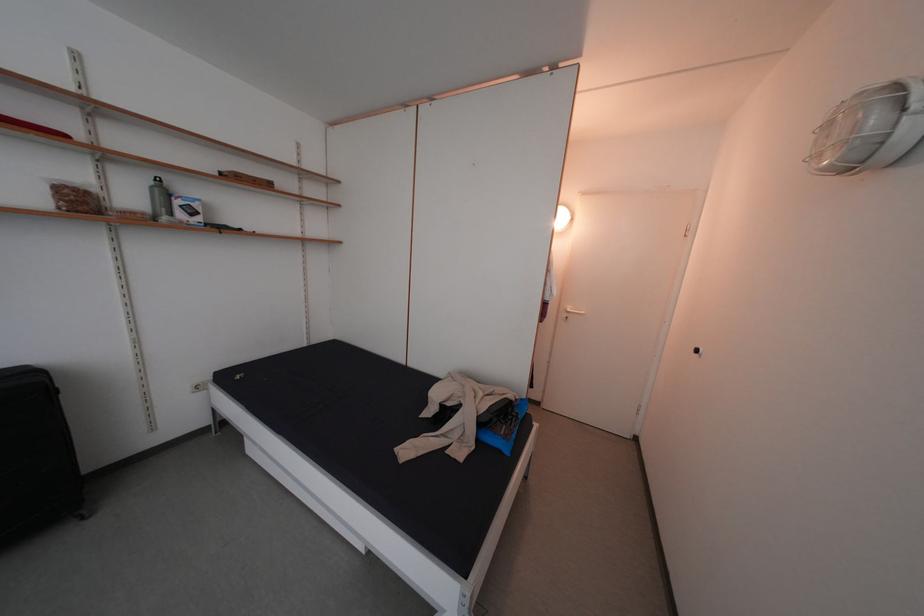
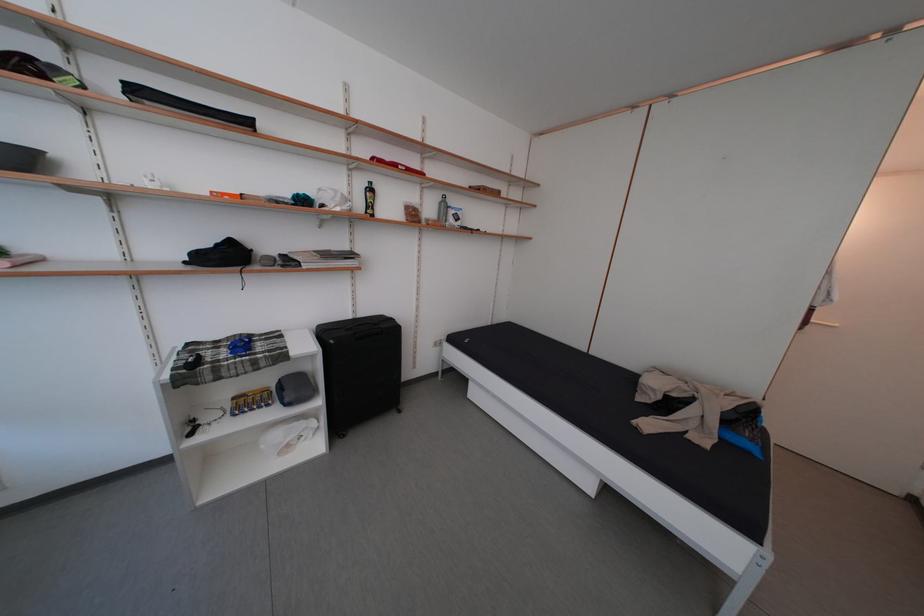
What movement of the cameraman would produce the second image?

The cameraman moved toward left, backward.